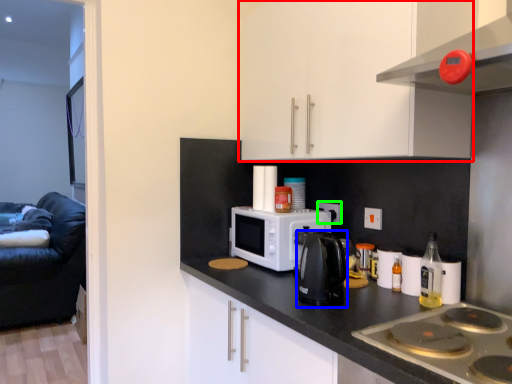
Question: Based on their relative distances, which object is nearer to cabinetry (highlighted by a red box)? Choose from kitchen appliance (highlighted by a blue box) and electric outlet (highlighted by a green box).

Choices:
 (A) kitchen appliance
 (B) electric outlet

Answer: (A)